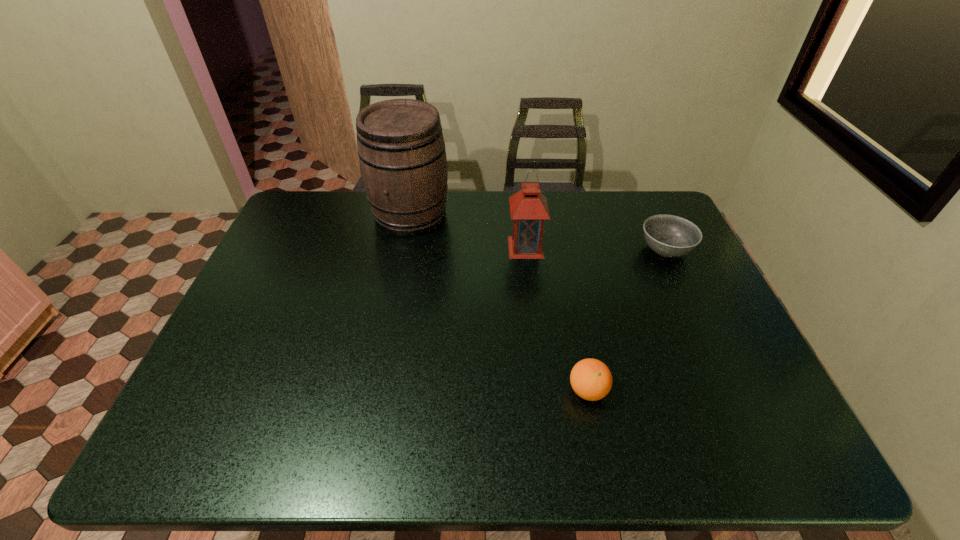
Identify the location of free area in between the lantern and the bowl. (595, 248).

This screenshot has height=540, width=960. I want to click on vacant region between the rightmost object and the lantern, so click(595, 248).

Identify the location of free point between the rightmost object and the nearest object. (627, 320).

Locate an element on the screen. The width and height of the screenshot is (960, 540). empty space that is in between the tallest object and the second tallest object is located at coordinates (468, 231).

Locate an element on the screen. Image resolution: width=960 pixels, height=540 pixels. blank region between the lantern and the third object from left to right is located at coordinates (557, 319).

The height and width of the screenshot is (540, 960). In order to click on free point between the orange and the lantern in this screenshot , I will do `click(557, 319)`.

What are the coordinates of `blank region between the second object from left to right and the bowl` in the screenshot? It's located at (595, 248).

Where is `free area in between the orange and the tallest object`? free area in between the orange and the tallest object is located at coordinates coord(499,302).

Identify the location of vacant area between the second object from right to left and the rightmost object. (627, 320).

Locate which object ranks second in proximity to the tallest object. Please provide its 2D coordinates. Your answer should be formatted as a tuple, i.e. [(x, y)], where the tuple contains the x and y coordinates of a point satisfying the conditions above.

[(591, 379)]